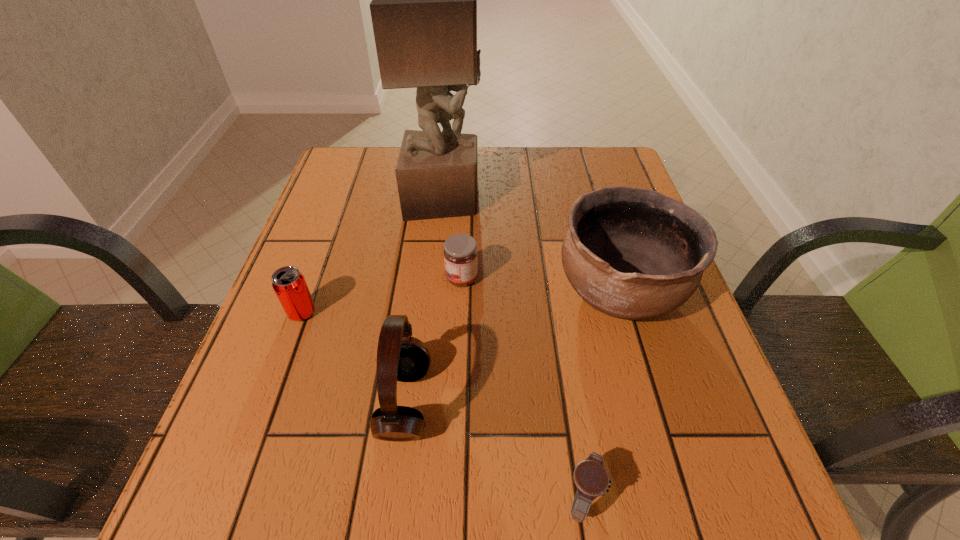
Where is `free space between the fifth farthest object and the pottery`? free space between the fifth farthest object and the pottery is located at coordinates (513, 347).

The height and width of the screenshot is (540, 960). I want to click on vacant area that lies between the headset and the pottery, so click(x=513, y=347).

At what (x,y) coordinates should I click in order to perform the action: click on free area in between the pottery and the nearest object. Please return your answer as a coordinate pair (x, y). The image size is (960, 540). Looking at the image, I should click on (600, 395).

Identify the location of empty location between the jam and the nearest object. (521, 388).

I want to click on free spot between the nearest object and the pottery, so click(600, 395).

Locate an element on the screen. This screenshot has height=540, width=960. empty location between the jam and the soda can is located at coordinates (382, 295).

Where is `the third closest object relative to the sculpture`? The height and width of the screenshot is (540, 960). the third closest object relative to the sculpture is located at coordinates (289, 284).

The width and height of the screenshot is (960, 540). Identify the location of the third closest object relative to the soda can. (424, 0).

In order to click on free space that satisfies the following two spatial constraints: 1. on the front-facing side of the shortest object; 2. on the left side of the farthest object in this screenshot , I will do `click(416, 498)`.

Locate an element on the screen. free region that satisfies the following two spatial constraints: 1. on the front-facing side of the sculpture; 2. on the front side of the soda can is located at coordinates (433, 313).